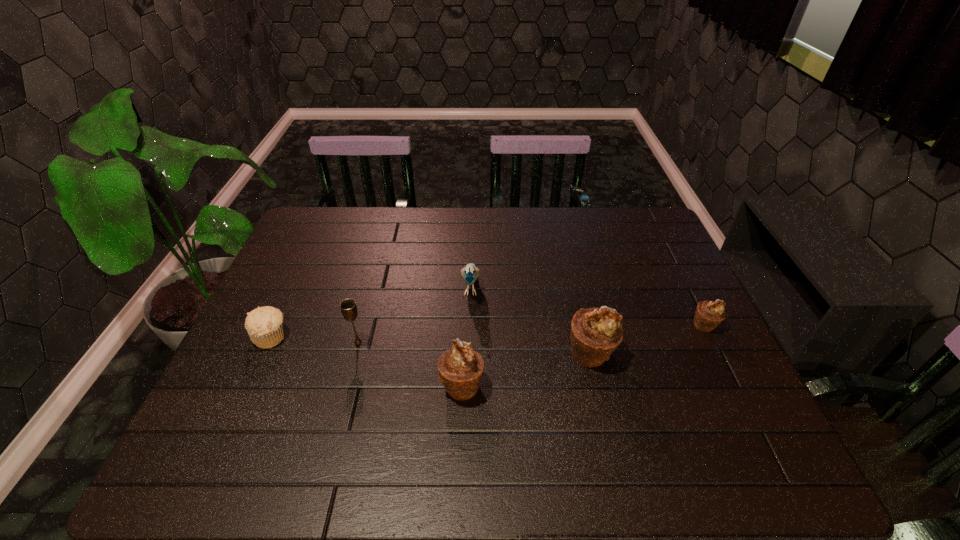
Identify which object is the closest to the farthest object. Please provide its 2D coordinates. Your answer should be formatted as a tuple, i.e. [(x, y)], where the tuple contains the x and y coordinates of a point satisfying the conditions above.

[(460, 369)]

What are the coordinates of `the third closest object to the chalice` in the screenshot? It's located at (470, 273).

At what (x,y) coordinates should I click in order to perform the action: click on muffin object that ranks as the second closest to the leftmost object. Please return your answer as a coordinate pair (x, y). Looking at the image, I should click on (595, 333).

This screenshot has width=960, height=540. What are the coordinates of `the third closest muffin to the second object from right to left` in the screenshot? It's located at [264, 325].

Identify the location of vacant space that satisfies the following two spatial constraints: 1. on the front side of the second muffin from right to left; 2. on the right side of the second object from left to right. (355, 353).

The height and width of the screenshot is (540, 960). Identify the location of free space in the image that satisfies the following two spatial constraints: 1. on the back side of the leftmost muffin; 2. on the left side of the rightmost object. (277, 325).

At what (x,y) coordinates should I click in order to perform the action: click on vacant space that satisfies the following two spatial constraints: 1. on the back side of the second muffin from right to left; 2. on the left side of the rightmost muffin. Please return your answer as a coordinate pair (x, y). Looking at the image, I should click on (584, 325).

Identify the location of vacant area in the image that satisfies the following two spatial constraints: 1. on the back side of the second tallest muffin; 2. on the right side of the rightmost object. (464, 325).

Locate an element on the screen. This screenshot has width=960, height=540. blank space that satisfies the following two spatial constraints: 1. at the face of the fifth object from left to right; 2. on the left side of the farthest object is located at coordinates (469, 353).